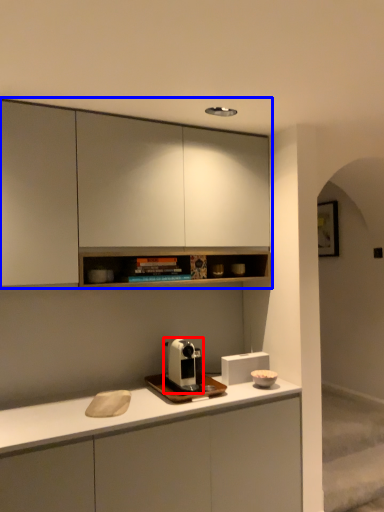
Question: Which of the following is the closest to the observer, coffee machine (highlighted by a red box) or cabinetry (highlighted by a blue box)?

Choices:
 (A) coffee machine
 (B) cabinetry

Answer: (B)